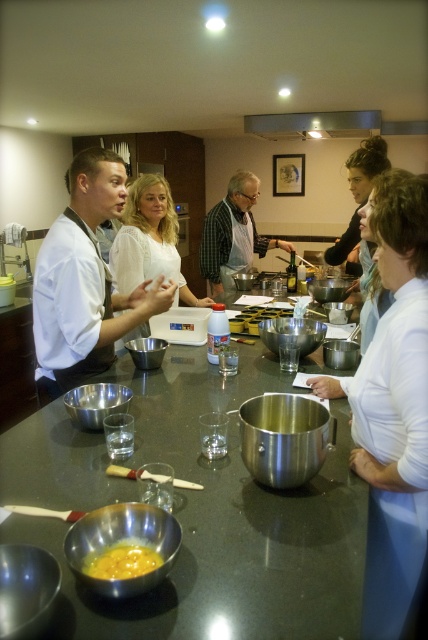
You are standing in the kitchen and see a point marked at coordinates (x=95, y=598). If you want to reach it without moving your feet, can you touch it with your outstretched hand?

The point at coordinates (x=95, y=598) is 35.56 inches away from you. Since the average human arm length is about 25 to 30 inches, you cannot reach it without moving your feet.

In the scene where a group of people are gathered around a kitchen counter in a professional kitchen environment, there is a point labeled as point (x=232, y=234). What object is located at this point?

The point (x=232, y=234) indicates a matte black apron at center.

You are organizing a cooking class and need to ensure there is enough space for participants to move around the shiny metallic table at center and the white glossy chef coat at center. Based on their sizes, which object requires more space to accommodate?

The shiny metallic table at center requires more space to accommodate because it has a larger size compared to the white glossy chef coat at center.